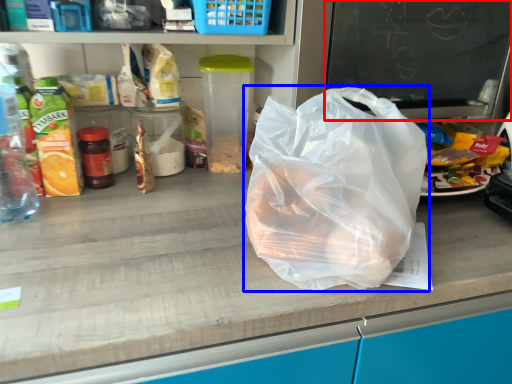
Question: Which object is further to the camera taking this photo, writing (highlighted by a red box) or plastic bag (highlighted by a blue box)?

Choices:
 (A) writing
 (B) plastic bag

Answer: (A)